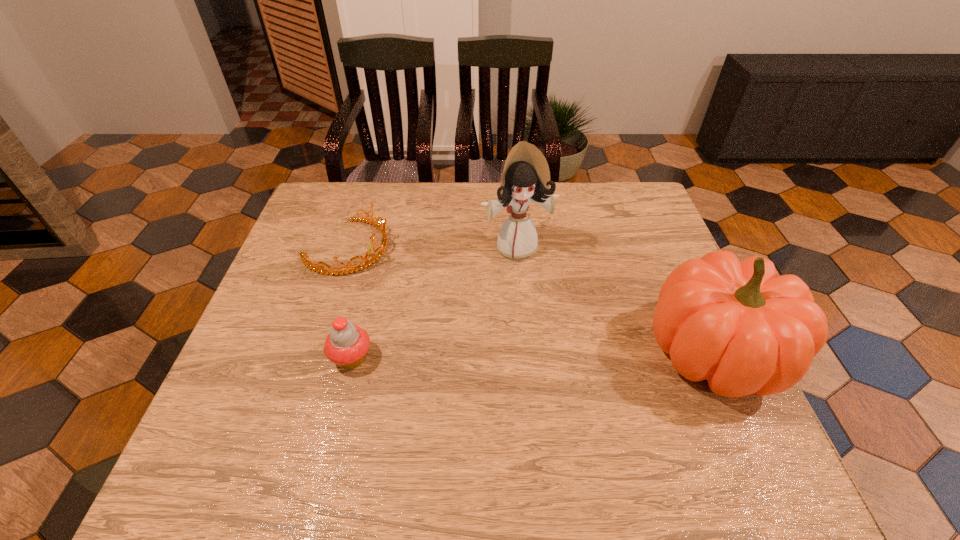
Where is `the third tallest object`? The image size is (960, 540). the third tallest object is located at coordinates (346, 345).

Where is `the rightmost object`? the rightmost object is located at coordinates (737, 324).

I want to click on doll, so click(526, 177).

Image resolution: width=960 pixels, height=540 pixels. Find the location of `tiara`. tiara is located at coordinates (350, 268).

What are the coordinates of `free location located 0.160m on the back of the second shortest object` in the screenshot? It's located at (x=369, y=289).

Identify the location of vacant region located at the front face of the doll. The width and height of the screenshot is (960, 540). (551, 328).

Identify the location of vacant area located at the front face of the doll. The width and height of the screenshot is (960, 540). (564, 364).

The image size is (960, 540). Find the location of `free region located at the front face of the doll`. free region located at the front face of the doll is located at coordinates (539, 298).

You are a GUI agent. You are given a task and a screenshot of the screen. Output one action in this format:
    pyautogui.click(x=<x>, y=<y>)
    Task: Click on the blank area located on the front-facing side of the tiara
    This screenshot has width=960, height=540.
    Given the screenshot: What is the action you would take?
    pyautogui.click(x=456, y=303)

Where is `free point located on the front-facing side of the tiara`? free point located on the front-facing side of the tiara is located at coordinates (449, 300).